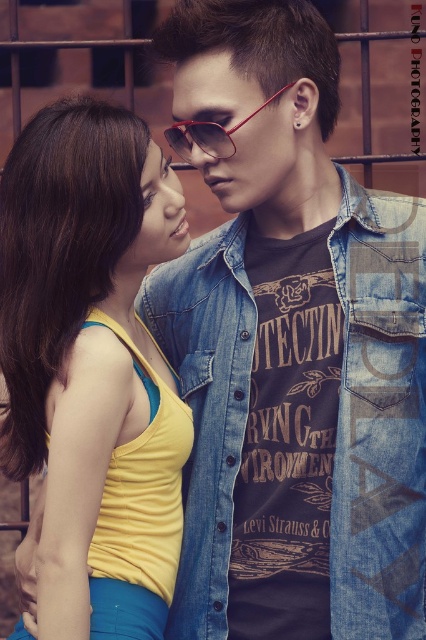
You are standing in front of the two people in the image. Which of the two points, point 1 at coordinates point (45, 444) or point 2 at coordinates point (215, 132), is closer to you?

Point 1 at coordinates point (45, 444) is closer to you because it is further to the camera than point 2 at coordinates point (215, 132).

You are a tailor measuring the distance between two garments for a custom fitting. You have a tape measure and need to determine if the yellow fabric tank top at left can be placed next to the denim jacket at center on a 24 inch wide shelf. Can the two garments fit side by side on the shelf?

The distance between the yellow fabric tank top at left and the denim jacket at center is 22.83 inches. Since the shelf is 24 inches wide, there is enough space to fit both garments side by side with a small gap remaining.